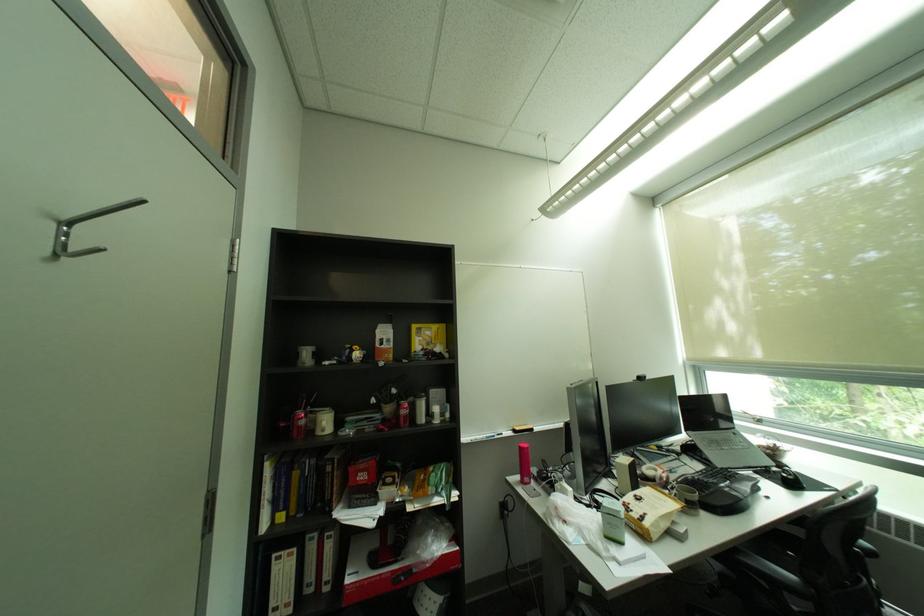
Find where to typ the black keyboard. Please return your answer as a coordinate pair (x, y).

(707, 479)